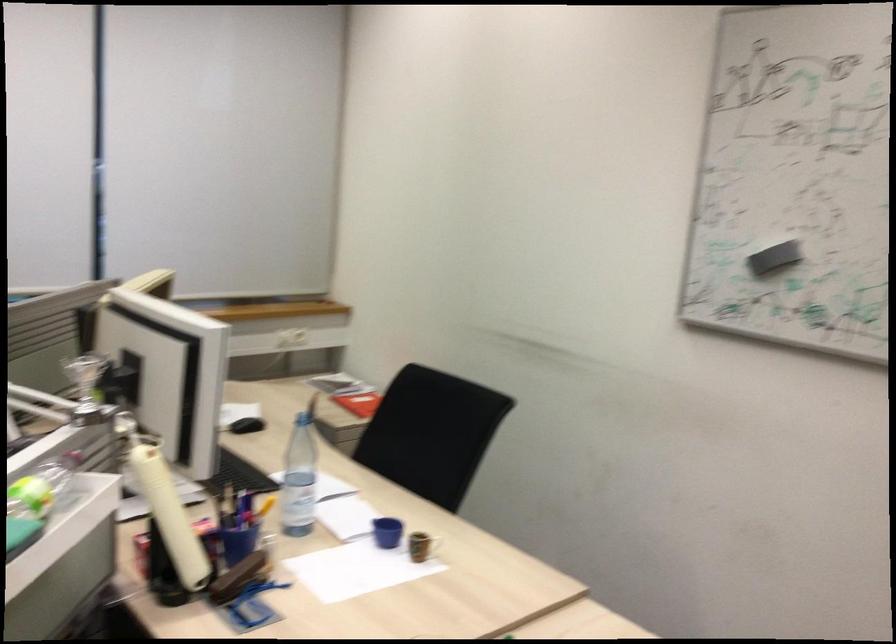
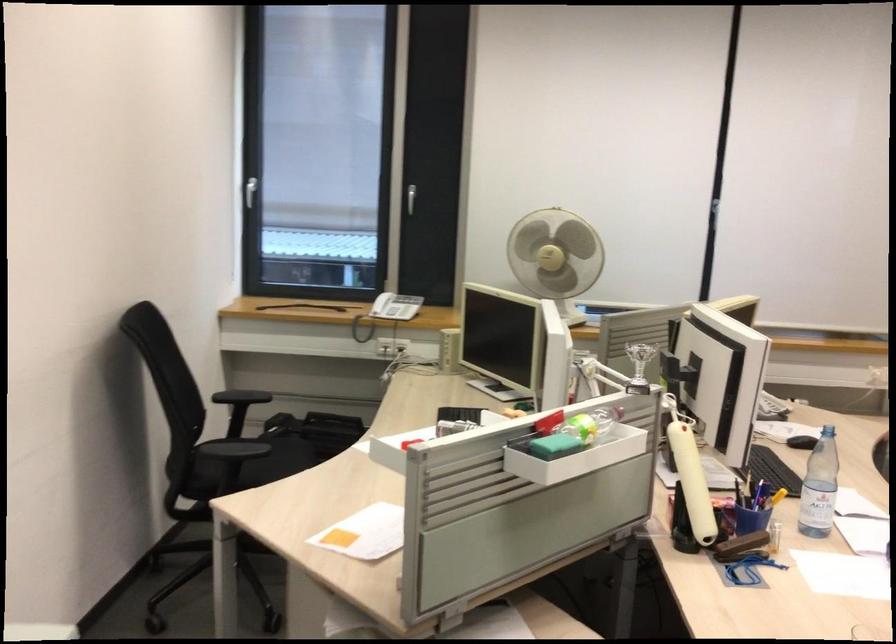
Locate, in the second image, the point that corresponds to (171,509) in the first image.

(690, 475)